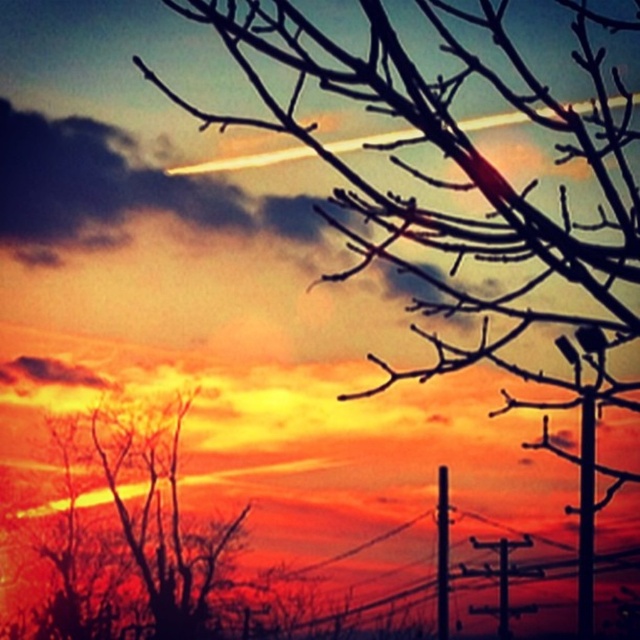
Question: From the image, what is the correct spatial relationship of metallic gray telegraph pole at center in relation to metallic gray telegraph pole at lower right?

Choices:
 (A) below
 (B) above

Answer: (B)

Question: Which object is closer to the camera taking this photo?

Choices:
 (A) smooth metallic pole at center right
 (B) metallic gray telegraph pole at lower right
 (C) silhouette bare tree at left

Answer: (A)

Question: Among these objects, which one is nearest to the camera?

Choices:
 (A) smooth metallic pole at center right
 (B) metallic gray telegraph pole at lower right
 (C) metallic gray telegraph pole at center

Answer: (A)

Question: Which of these objects is positioned closest to the metallic gray telegraph pole at lower right?

Choices:
 (A) metallic gray telegraph pole at center
 (B) smooth metallic pole at center right
 (C) silhouette bare tree at left

Answer: (A)

Question: Does smooth metallic pole at center right have a greater width compared to metallic gray telegraph pole at lower right?

Choices:
 (A) yes
 (B) no

Answer: (A)

Question: Does smooth metallic pole at center right have a lesser width compared to metallic gray telegraph pole at center?

Choices:
 (A) yes
 (B) no

Answer: (B)